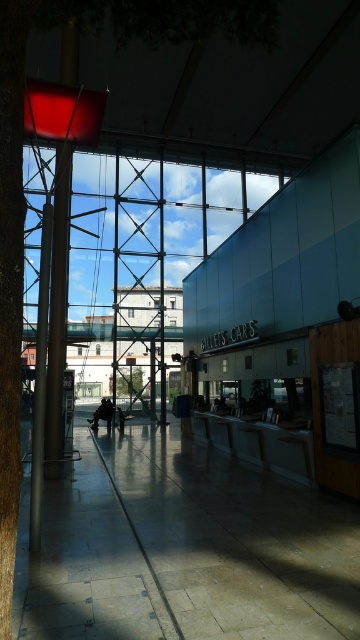
Which of these two, polished concrete floor at center or green leafy tree at center, stands taller?

Standing taller between the two is green leafy tree at center.

Is polished concrete floor at center thinner than green leafy tree at center?

In fact, polished concrete floor at center might be wider than green leafy tree at center.

Is point (234, 515) more distant than point (119, 378)?

No, it is not.

Identify the location of polished concrete floor at center. (183, 548).

Measure the distance between polished silver pole at left and camera.

polished silver pole at left is 18.42 feet from camera.

From the picture: Can you confirm if polished silver pole at left is smaller than dark gray fabric jacket at center?

Correct, polished silver pole at left occupies less space than dark gray fabric jacket at center.

Between point (42, 410) and point (101, 417), which one is positioned in front?

Point (42, 410) is more forward.

Locate an element on the screen. This screenshot has width=360, height=640. polished silver pole at left is located at coordinates (39, 380).

How distant is green leafy tree at center from dark gray fabric jacket at center?

9.10 feet

Is green leafy tree at center bigger than dark gray fabric jacket at center?

Actually, green leafy tree at center might be smaller than dark gray fabric jacket at center.

Is point (140, 387) positioned in front of point (97, 413)?

No, (140, 387) is further to viewer.

Locate an element on the screen. green leafy tree at center is located at coordinates (128, 381).